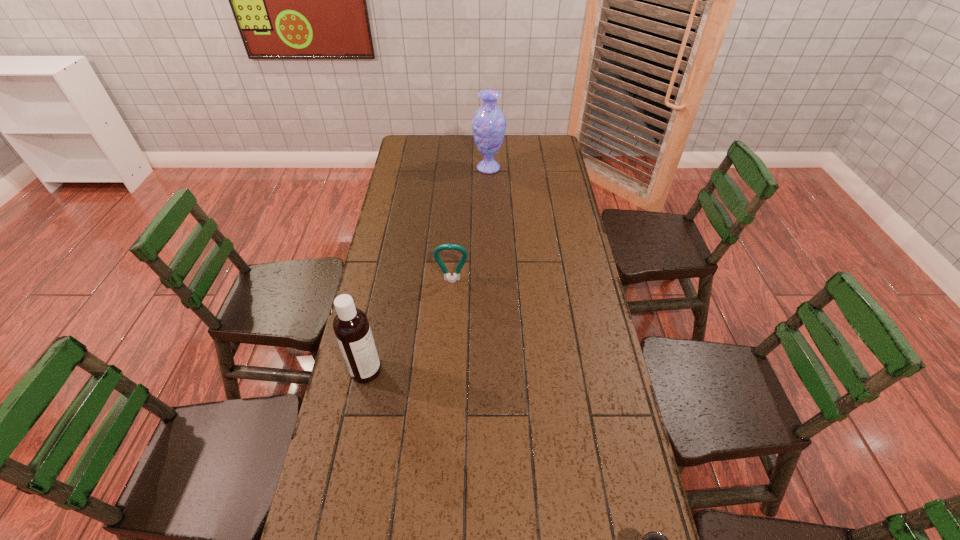
This screenshot has width=960, height=540. In order to click on the second object from right to left in this screenshot , I will do `click(489, 123)`.

What are the coordinates of `the farthest object` in the screenshot? It's located at (489, 123).

At what (x,y) coordinates should I click in order to perform the action: click on dishwasher detergent. Please return your answer as a coordinate pair (x, y). The height and width of the screenshot is (540, 960). Looking at the image, I should click on (351, 327).

This screenshot has height=540, width=960. Find the location of `the leftmost object`. the leftmost object is located at coordinates (351, 327).

In order to click on the third tallest object in this screenshot , I will do `click(456, 276)`.

What are the coordinates of `the third object from right to left` in the screenshot? It's located at (456, 276).

Identify the location of free space located 0.340m on the front of the vase. click(x=490, y=225).

Locate an element on the screen. vacant area situated on the label side of the leftmost object is located at coordinates (398, 371).

Identify the location of vacant space located at the jaws of the third nearest object. This screenshot has height=540, width=960. (451, 301).

Find the location of `object situated at the far edge`. object situated at the far edge is located at coordinates (489, 123).